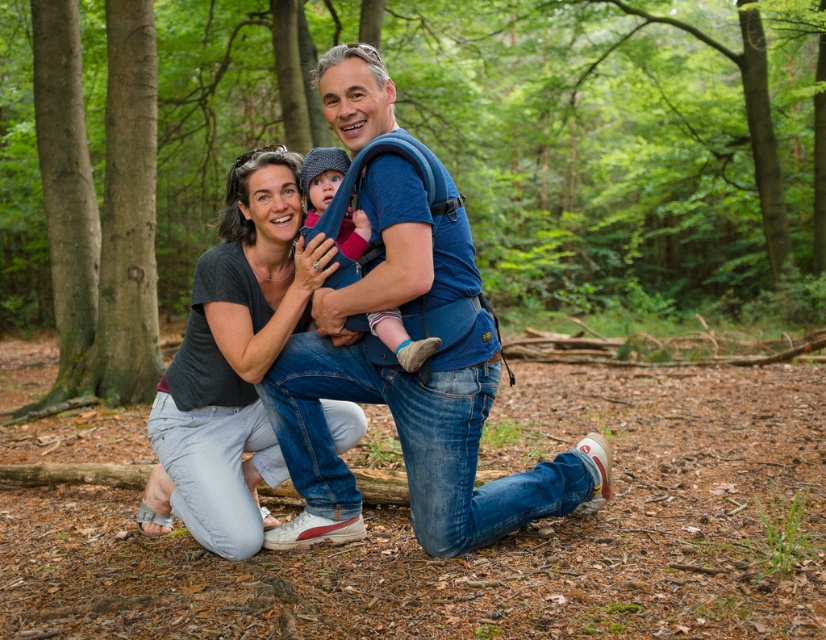
Question: Is blue fabric baby carrier at center bigger than knitted wool hat at center?

Choices:
 (A) no
 (B) yes

Answer: (B)

Question: Among these points, which one is farthest from the camera?

Choices:
 (A) (205, 116)
 (B) (302, 358)
 (C) (411, 364)
 (D) (328, 243)

Answer: (A)

Question: Which point is farther to the camera?

Choices:
 (A) green leafy forest at center
 (B) blue fabric baby carrier at center

Answer: (A)

Question: Is blue fabric baby carrier at center below knitted wool hat at center?

Choices:
 (A) yes
 (B) no

Answer: (A)

Question: Can you confirm if blue fabric baby carrier at center is positioned below matte gray shirt at center?

Choices:
 (A) no
 (B) yes

Answer: (A)

Question: Which of the following is the closest to the observer?

Choices:
 (A) (464, 540)
 (B) (321, 189)

Answer: (A)